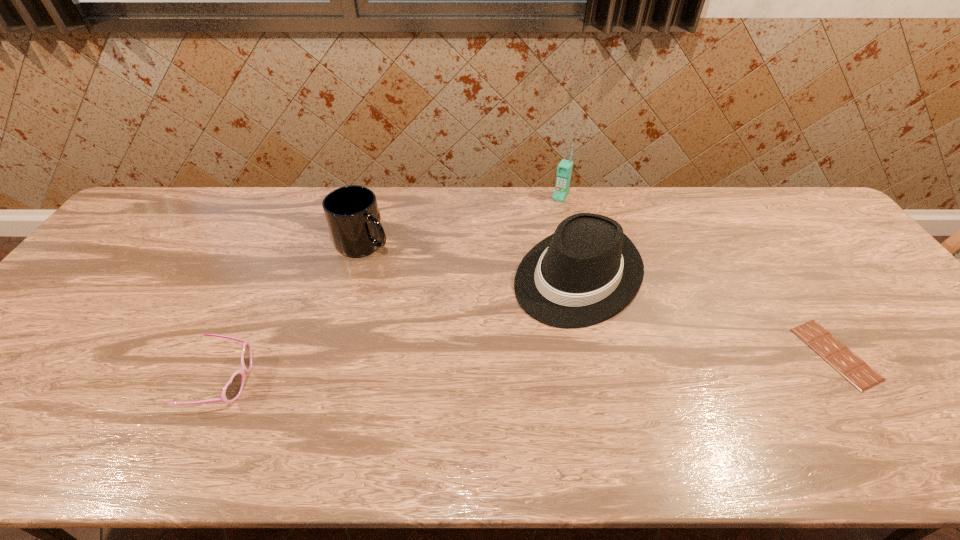
Find the location of `cellular telephone located in the far edge section of the desktop`. cellular telephone located in the far edge section of the desktop is located at coordinates (564, 169).

At what (x,y) coordinates should I click in order to perform the action: click on mug that is at the far edge. Please return your answer as a coordinate pair (x, y). The image size is (960, 540). Looking at the image, I should click on (352, 214).

Where is `sunglasses located in the near edge section of the desktop`? sunglasses located in the near edge section of the desktop is located at coordinates (232, 390).

Where is `chocolate bar located at the near edge`? chocolate bar located at the near edge is located at coordinates point(857,372).

Identify the location of vacant space at the far edge. This screenshot has width=960, height=540. (396, 232).

What are the coordinates of `vacant space at the near edge` in the screenshot? It's located at (825, 411).

The width and height of the screenshot is (960, 540). In the image, there is a desktop. What are the coordinates of `vacant space at the left edge` in the screenshot? It's located at (132, 241).

This screenshot has width=960, height=540. In order to click on vacant area at the right edge of the desktop in this screenshot , I will do `click(853, 272)`.

What are the coordinates of `vacant space at the far left corner` in the screenshot? It's located at (179, 189).

I want to click on blank region between the rightmost object and the fedora, so click(x=708, y=315).